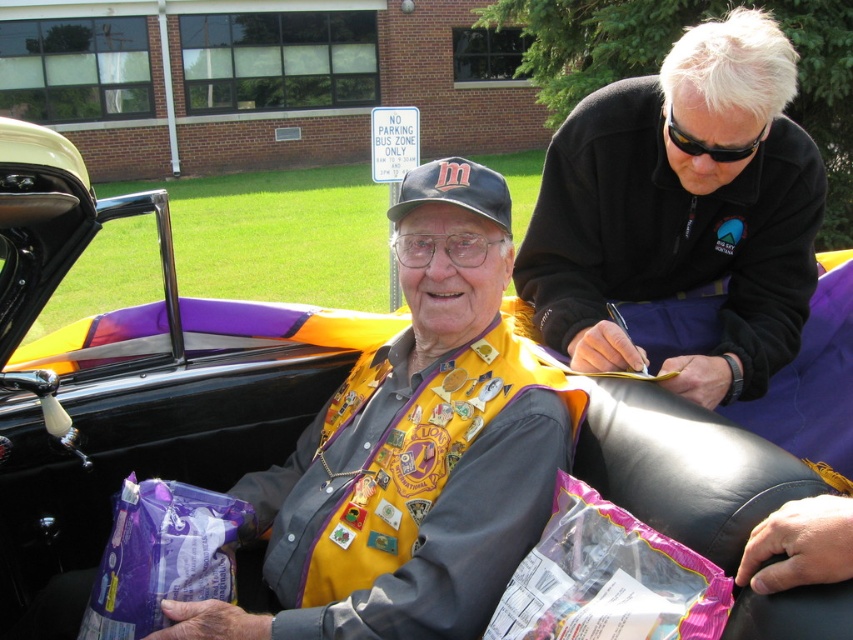
Question: Is yellow fabric vest at center bigger than purple plastic bag at lower left?

Choices:
 (A) yes
 (B) no

Answer: (A)

Question: Among these points, which one is farthest from the camera?

Choices:
 (A) (135, 614)
 (B) (576, 228)
 (C) (386, 556)

Answer: (B)

Question: Is black matte jacket at upper right above purple plastic bag at lower left?

Choices:
 (A) yes
 (B) no

Answer: (A)

Question: Is black matte jacket at upper right further to the viewer compared to purple plastic bag at lower left?

Choices:
 (A) yes
 (B) no

Answer: (A)

Question: Which is nearer to the purple plastic bag at lower left?

Choices:
 (A) yellow fabric vest at center
 (B) black matte jacket at upper right

Answer: (A)

Question: Which of the following is the farthest from the observer?

Choices:
 (A) (500, 344)
 (B) (798, 291)

Answer: (B)